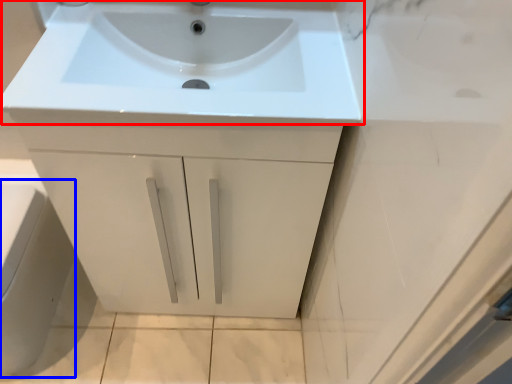
Question: Which object is further to the camera taking this photo, sink (highlighted by a red box) or porcelain (highlighted by a blue box)?

Choices:
 (A) sink
 (B) porcelain

Answer: (B)